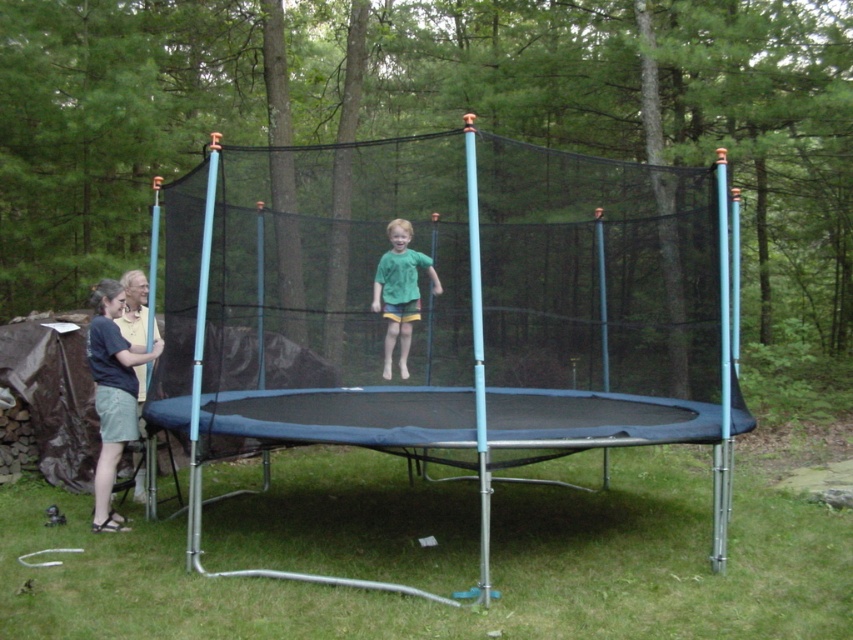
Does black mesh net at center lie in front of green matte shirt at center?

Yes, it is.

Can you confirm if black mesh net at center is thinner than green matte shirt at center?

Incorrect, black mesh net at center's width is not less than green matte shirt at center's.

What do you see at coordinates (454, 314) in the screenshot? I see `black mesh net at center` at bounding box center [454, 314].

Where is `black mesh net at center`? Image resolution: width=853 pixels, height=640 pixels. black mesh net at center is located at coordinates (454, 314).